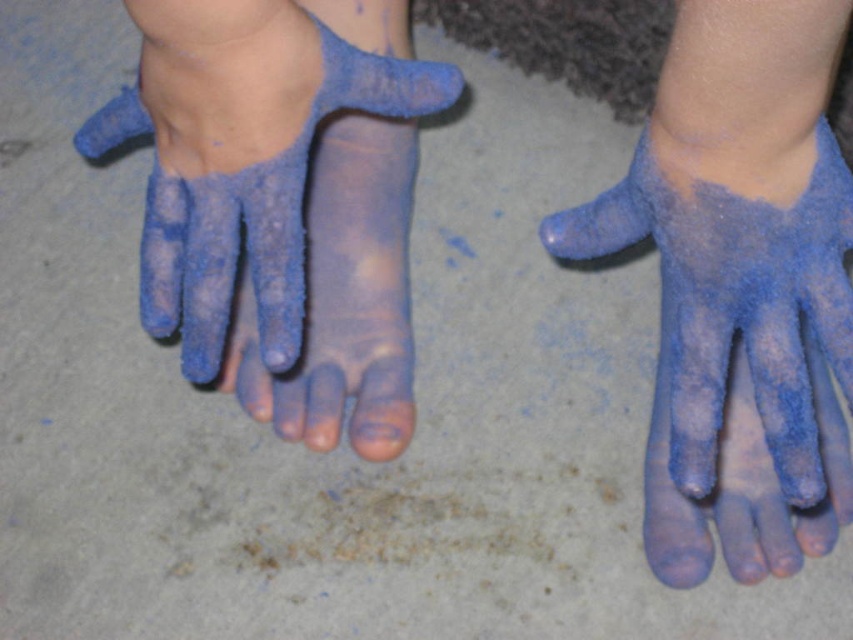
Does blue powder foot at center appear on the right side of blue matte sand at center?

Yes, blue powder foot at center is to the right of blue matte sand at center.

Is point (572, 221) behind point (222, 140)?

Yes, point (572, 221) is farther from viewer.

Locate an element on the screen. blue powder foot at center is located at coordinates (740, 288).

Does blue matte sand at center have a lesser width compared to blue fuzzy glove at center?

In fact, blue matte sand at center might be wider than blue fuzzy glove at center.

Between blue matte sand at center and blue fuzzy glove at center, which one is positioned higher?

blue matte sand at center

Is point (283, 268) farther from camera compared to point (664, 576)?

No.

Find the location of `blue matte sand at center`. blue matte sand at center is located at coordinates (280, 214).

Does blue powder foot at center come behind blue fuzzy glove at center?

No.

Between blue powder foot at center and blue fuzzy glove at center, which one is positioned higher?

Positioned higher is blue powder foot at center.

Describe the element at coordinates (740, 288) in the screenshot. This screenshot has height=640, width=853. I see `blue powder foot at center` at that location.

You are a GUI agent. You are given a task and a screenshot of the screen. Output one action in this format:
    pyautogui.click(x=<x>, y=<y>)
    Task: Click on the blue powder foot at center
    This screenshot has height=640, width=853.
    Given the screenshot: What is the action you would take?
    pyautogui.click(x=740, y=288)